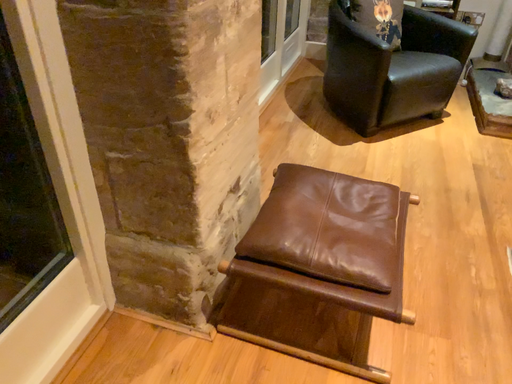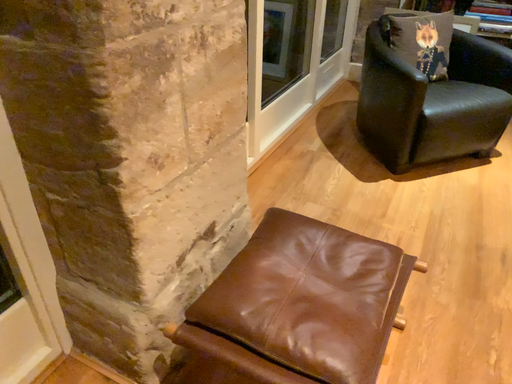
Question: How did the camera likely rotate when shooting the video?

Choices:
 (A) rotated right
 (B) rotated left

Answer: (B)